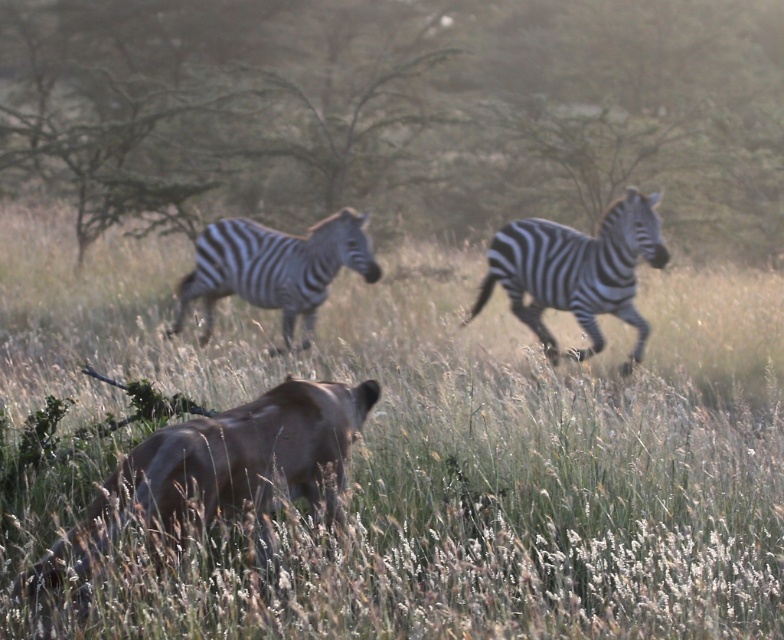
What is the coordinate of the green grassy at center?

The coordinate of the green grassy at center is at point [408,452].

You are a wildlife photographer trying to capture a photo of the brown fur antelope at lower left and the black and white striped zebra at right. Based on their sizes, which animal should you focus on to ensure both fit in the frame without cropping?

The brown fur antelope at lower left is smaller than the black and white striped zebra at right. To ensure both fit in the frame without cropping, focus on the smaller brown fur antelope at lower left since it requires less space.

You are a wildlife photographer trying to capture a photo of the brown fur antelope at lower left and the black and white striped zebra at right. Which animal is closer to the camera?

The brown fur antelope at lower left is closer to the camera because it is in front of the black and white striped zebra at right.